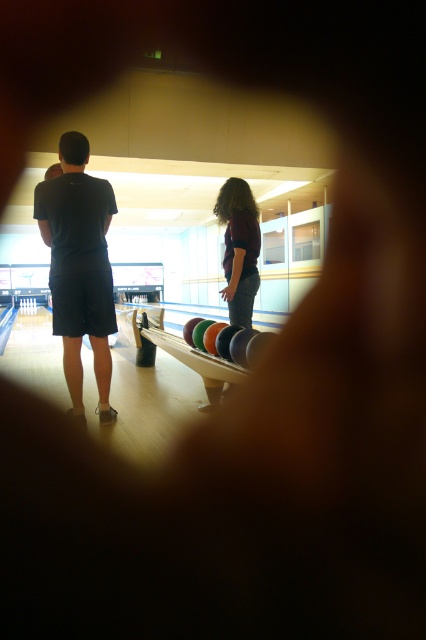
Is point (71, 353) closer to viewer compared to point (247, 202)?

Yes, it is in front of point (247, 202).

Which is more to the left, dark gray shorts at center or maroon fabric shirt at center?

Positioned to the left is dark gray shorts at center.

Does point (77, 253) come in front of point (238, 243)?

Yes, point (77, 253) is in front of point (238, 243).

Locate an element on the screen. dark gray shorts at center is located at coordinates (80, 266).